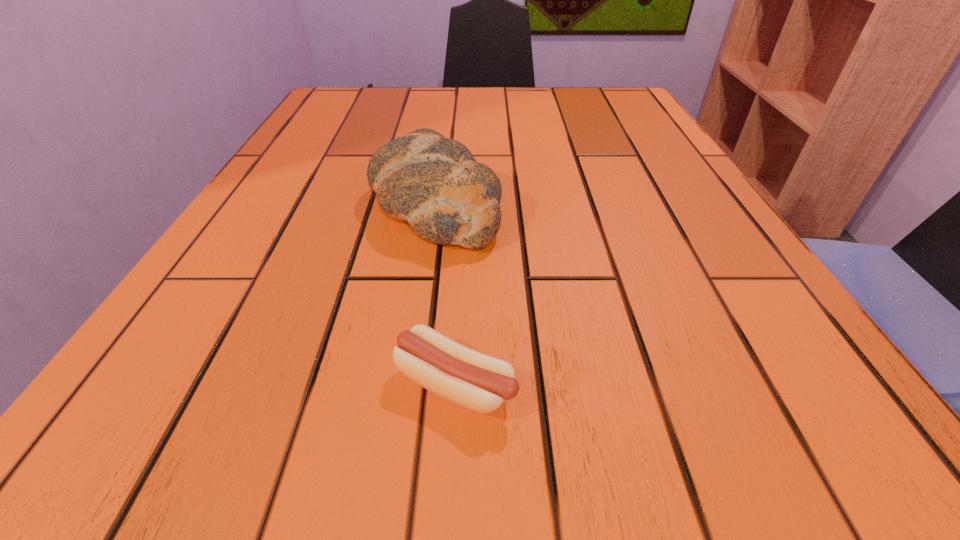
Locate an element on the screen. bread is located at coordinates (435, 183).

Identify the location of the taller object. The image size is (960, 540). (435, 183).

I want to click on sausage, so tap(476, 381).

Locate an element on the screen. the shorter object is located at coordinates (476, 381).

Where is `free region located 0.230m on the front of the bread`? This screenshot has height=540, width=960. free region located 0.230m on the front of the bread is located at coordinates (406, 399).

In order to click on free space located 0.170m on the back of the sausage in this screenshot , I will do `click(462, 252)`.

This screenshot has width=960, height=540. In order to click on object that is at the near edge in this screenshot , I will do `click(476, 381)`.

In the image, there is a desktop. Identify the location of vacant space at the far edge. (470, 108).

Locate an element on the screen. Image resolution: width=960 pixels, height=540 pixels. vacant space at the near edge of the desktop is located at coordinates (559, 390).

You are a GUI agent. You are given a task and a screenshot of the screen. Output one action in this format:
    pyautogui.click(x=<x>, y=<y>)
    Task: Click on the free space at the left edge of the desktop
    Image resolution: width=960 pixels, height=540 pixels.
    Given the screenshot: What is the action you would take?
    pyautogui.click(x=286, y=200)